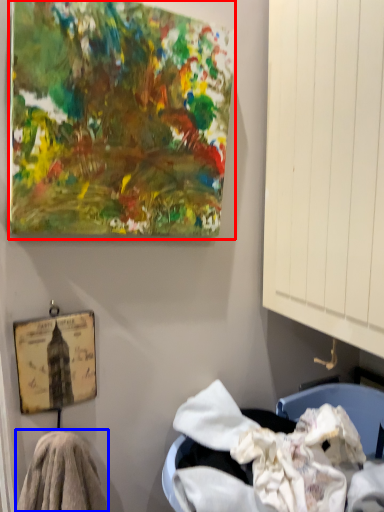
Question: Which object appears closest to the camera in this image, oil painting (highlighted by a red box) or material (highlighted by a blue box)?

Choices:
 (A) oil painting
 (B) material

Answer: (A)